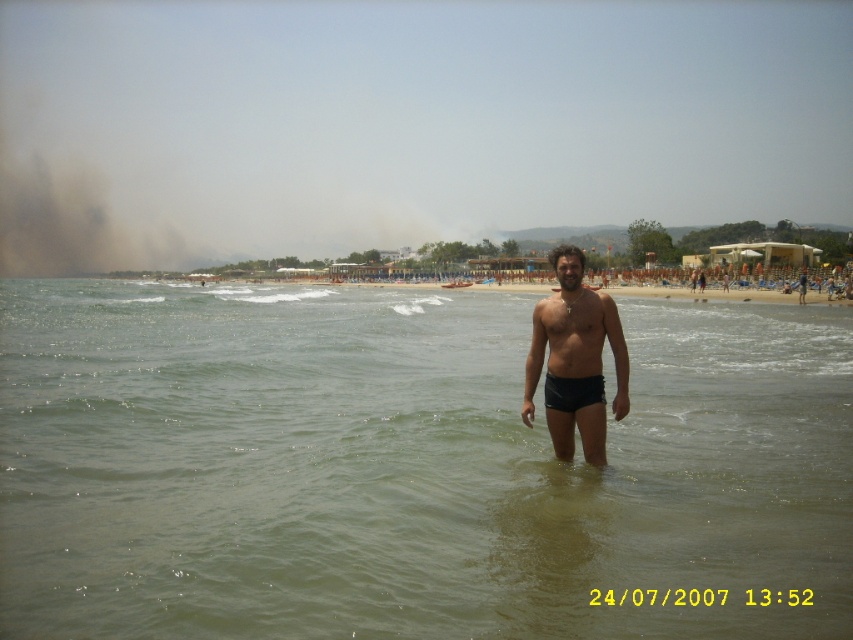
Question: Which of the following is the farthest from the observer?

Choices:
 (A) (769, 516)
 (B) (564, 456)

Answer: (B)

Question: Is greenish water at center further to the viewer compared to black matte shorts at center?

Choices:
 (A) no
 (B) yes

Answer: (A)

Question: Can you confirm if greenish water at center is positioned below black matte shorts at center?

Choices:
 (A) no
 (B) yes

Answer: (A)

Question: Does greenish water at center have a greater width compared to black matte shorts at center?

Choices:
 (A) yes
 (B) no

Answer: (A)

Question: Which object is closer to the camera taking this photo?

Choices:
 (A) greenish water at center
 (B) black matte shorts at center

Answer: (A)